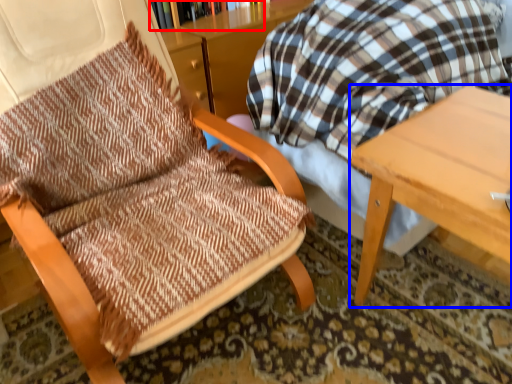
Question: Which of the following is the closest to the observer, bookcase (highlighted by a red box) or table (highlighted by a blue box)?

Choices:
 (A) bookcase
 (B) table

Answer: (B)